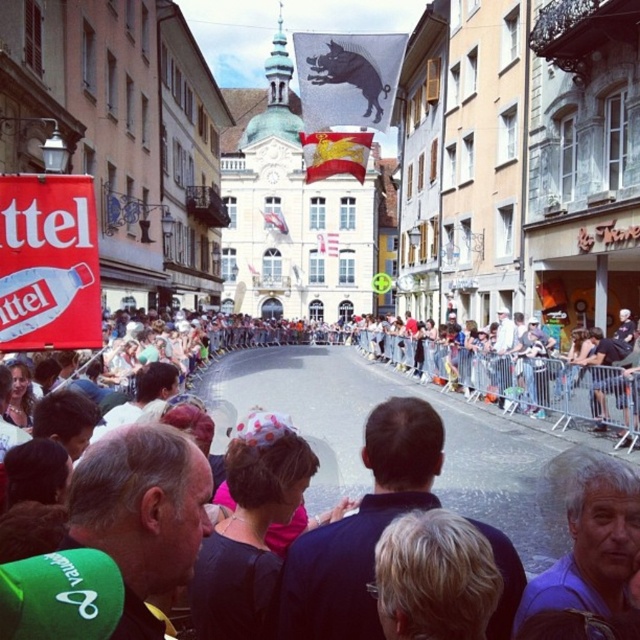
Does white plastic sign at upper left have a greater height compared to gray hair at center?

Correct, white plastic sign at upper left is much taller as gray hair at center.

Is white plastic sign at upper left wider than gray hair at center?

Incorrect, white plastic sign at upper left's width does not surpass gray hair at center's.

Which is in front, point (64, 296) or point (563, 465)?

Point (563, 465)

You are a GUI agent. You are given a task and a screenshot of the screen. Output one action in this format:
    pyautogui.click(x=<x>, y=<y>)
    Task: Click on the white plastic sign at upper left
    This screenshot has width=640, height=640.
    Given the screenshot: What is the action you would take?
    pyautogui.click(x=49, y=262)

Can you confirm if matte black banner at center is positioned below white plastic sign at upper left?

Correct, matte black banner at center is located below white plastic sign at upper left.

Does matte black banner at center appear over white plastic sign at upper left?

No.

Is point (536, 428) in front of point (26, 253)?

No, it is behind (26, 253).

Find the location of a particular element. matte black banner at center is located at coordinates (362, 426).

Does matte black banner at center have a larger size compared to gray hair at center?

Correct, matte black banner at center is larger in size than gray hair at center.

Can you confirm if matte black banner at center is wider than gray hair at center?

Yes.

Is point (268, 376) positioned after point (568, 451)?

Yes, it is.

Locate an element on the screen. matte black banner at center is located at coordinates (362, 426).